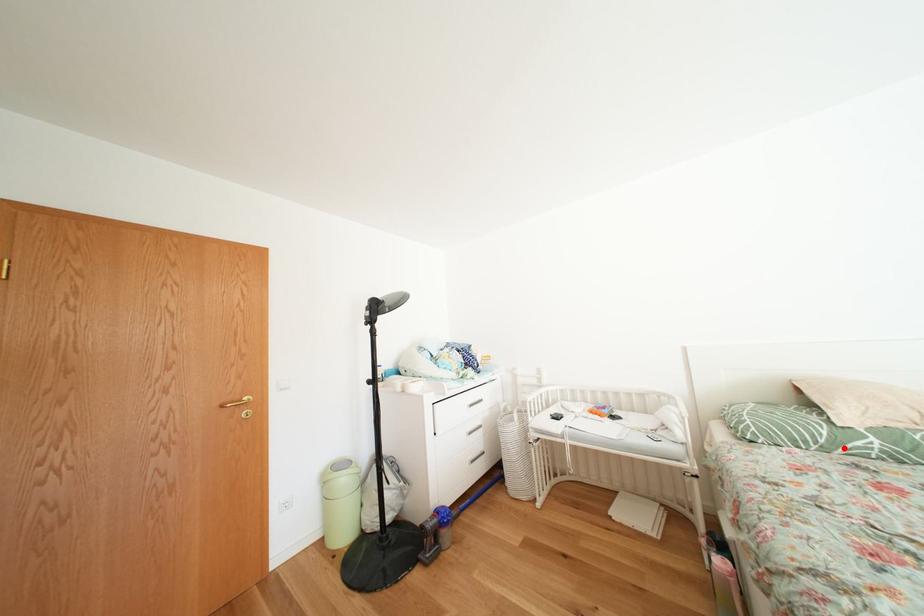
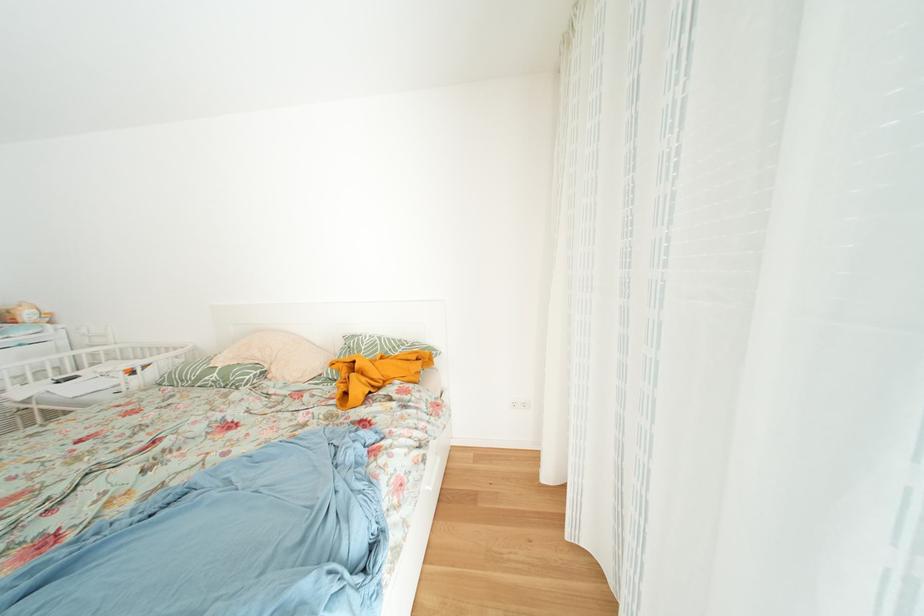
In the second image, find the point that corresponds to the highlighted location in the first image.

(208, 384)